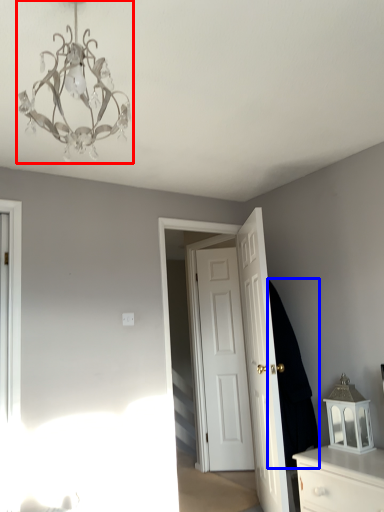
Question: Among these objects, which one is nearest to the camera, lamp (highlighted by a red box) or dark (highlighted by a blue box)?

Choices:
 (A) lamp
 (B) dark

Answer: (A)